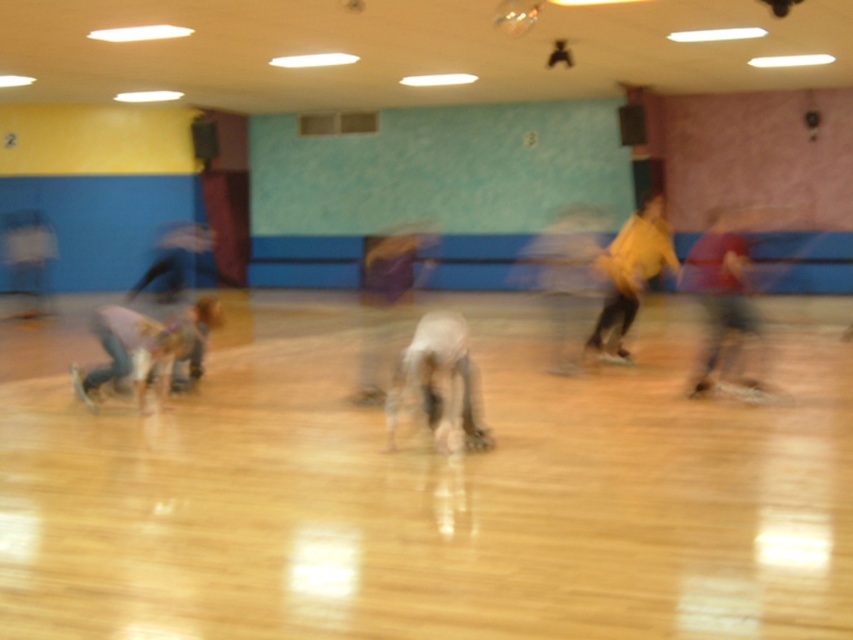
Question: Does light blue jeans at lower left appear under yellow matte shirt at right?

Choices:
 (A) no
 (B) yes

Answer: (B)

Question: Which of these objects is positioned farthest from the white matte person at center?

Choices:
 (A) white matte skate at lower right
 (B) light blue jeans at lower left

Answer: (A)

Question: Which point is farther to the camera?

Choices:
 (A) white matte skate at lower right
 (B) yellow matte shirt at right
 (C) white matte person at center
 (D) light blue jeans at lower left

Answer: (B)

Question: Can you confirm if white matte person at center is positioned above light blue jeans at lower left?

Choices:
 (A) yes
 (B) no

Answer: (B)

Question: Which point is farther to the camera?

Choices:
 (A) (672, 273)
 (B) (701, 371)
 (C) (734, 381)
 (D) (405, 365)

Answer: (A)

Question: Is white matte person at center bigger than red fabric shirt at right?

Choices:
 (A) yes
 (B) no

Answer: (A)